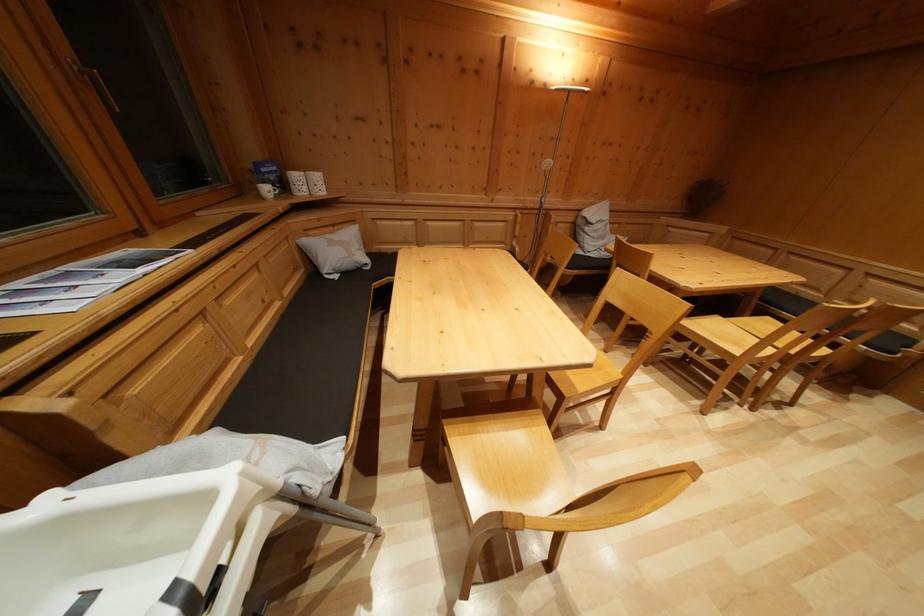
Identify the location of grey throw pillow. (335, 252).